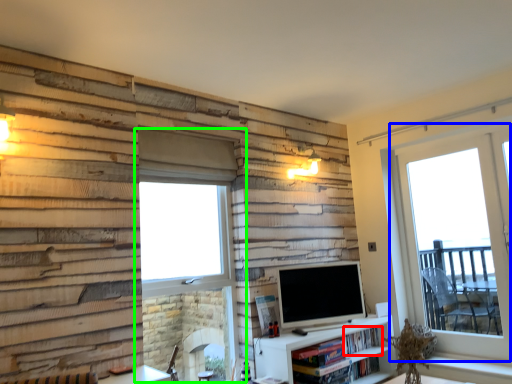
Question: Considering the real-world distances, which object is farthest from book (highlighted by a red box)? window (highlighted by a blue box) or window (highlighted by a green box)?

Choices:
 (A) window
 (B) window

Answer: (B)